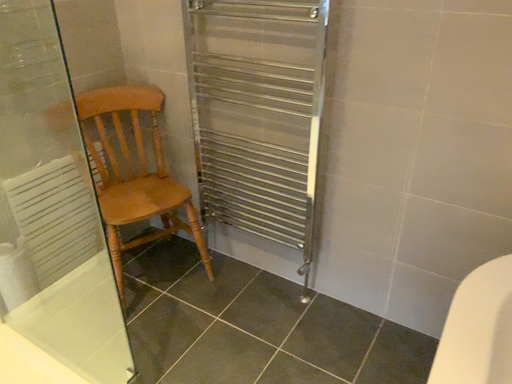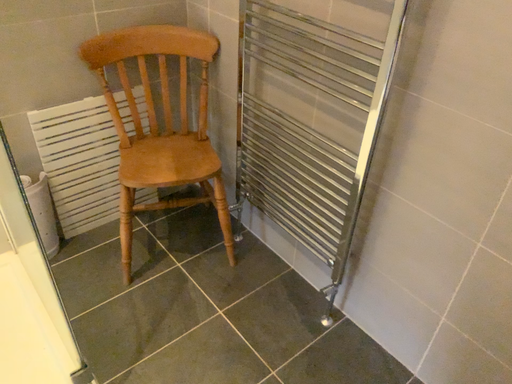
Question: Which way did the camera rotate in the video?

Choices:
 (A) rotated left
 (B) rotated right

Answer: (A)